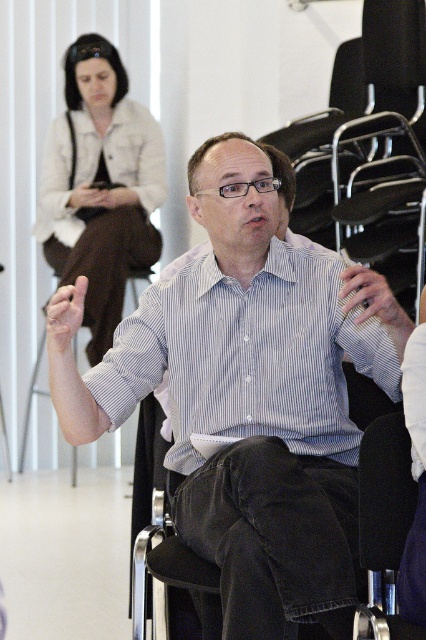
You are a photographer trying to capture a candid shot of the blue striped shirt at center and the matte skin hand at center. Since you want to focus on the shirt, should you adjust your camera to focus on the object that is closer to the lens?

Yes, you should focus on the blue striped shirt at center because it is in front of the matte skin hand at center, making it closer to the camera lens.

You are an interior designer observing the conference room scene. You need to determine if the matte white blouse at upper left can be placed on top of the matte skin hand at center without overlapping the hand completely. Based on their heights, can this be done?

The matte white blouse at upper left has a greater height compared to the matte skin hand at center. Since the blouse is taller, placing it on top would completely cover the hand, making it impossible to do so without full overlap.

You are a photographer standing in the conference room. You want to take a photo of the matte white blouse at upper left and the matte skin hand at center. The camera you are using has a maximum focus range of 8 feet. Will both objects be in focus?

The matte white blouse at upper left is 8.95 feet away from the matte skin hand at center. Since the camera can only focus up to 8 feet, the distance between them exceeds the focus range. Therefore, both objects cannot be in focus simultaneously.